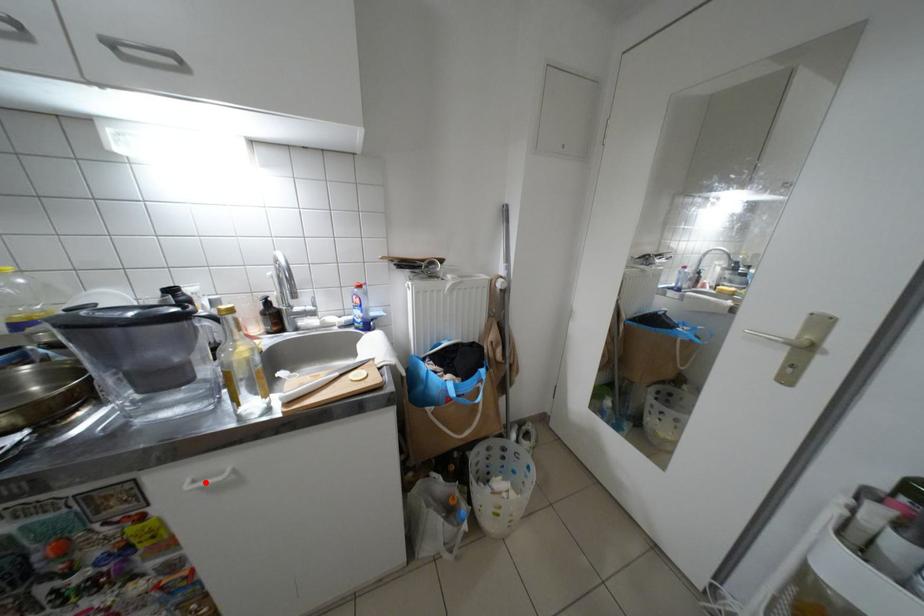
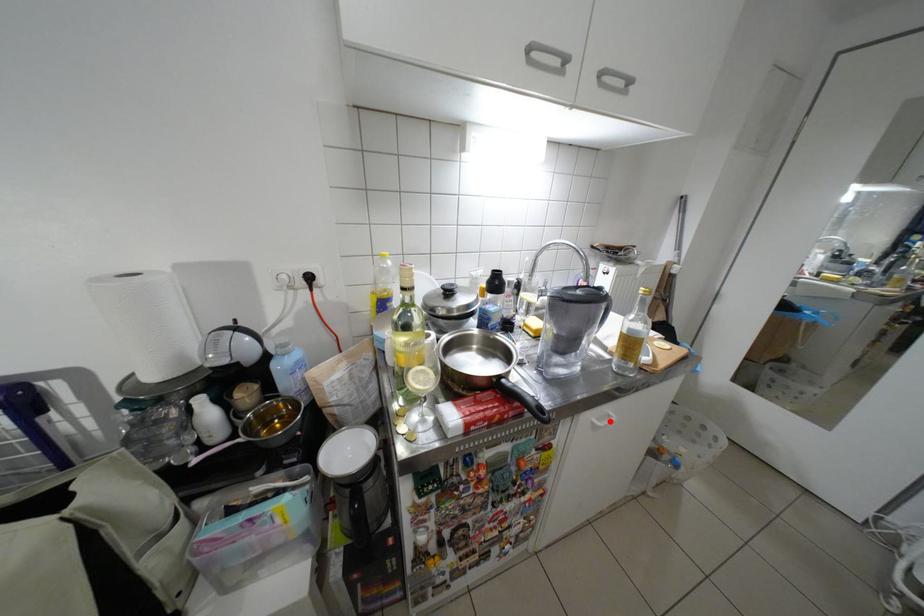
I am providing you with two images of the same scene from different viewpoints. A red point is marked on the first image and another point is marked on the second image. Does the point marked in image1 correspond to the same location as the one in image2?

Yes